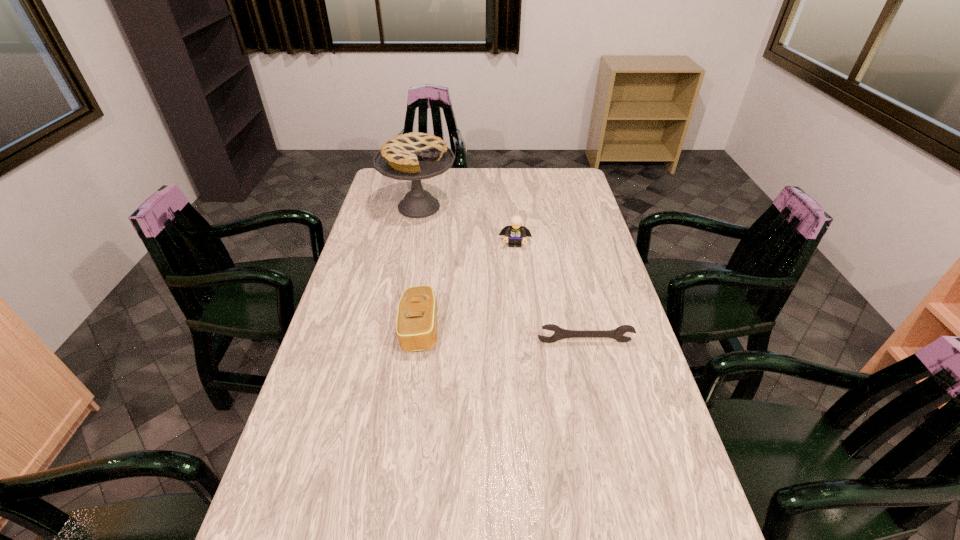
The image size is (960, 540). Identify the location of free space at the right edge of the desktop. (641, 480).

The height and width of the screenshot is (540, 960). In order to click on free area in between the wrench and the tallest object in this screenshot , I will do `click(502, 274)`.

You are a GUI agent. You are given a task and a screenshot of the screen. Output one action in this format:
    pyautogui.click(x=<x>, y=<y>)
    Task: Click on the vacant point located between the clutch bag and the farthest object
    This screenshot has height=540, width=960.
    Given the screenshot: What is the action you would take?
    pyautogui.click(x=420, y=268)

Where is `free space between the third tallest object and the second farthest object`? The image size is (960, 540). free space between the third tallest object and the second farthest object is located at coordinates (468, 286).

Where is `free spot between the clutch bag and the pie`? This screenshot has width=960, height=540. free spot between the clutch bag and the pie is located at coordinates (420, 268).

Locate an element on the screen. Image resolution: width=960 pixels, height=540 pixels. free spot between the tallest object and the shortest object is located at coordinates (502, 274).

Where is `blank region between the third tallest object and the tallest object`? blank region between the third tallest object and the tallest object is located at coordinates (420, 268).

Find the location of a particular element. The image size is (960, 540). free space between the tallest object and the wrench is located at coordinates (502, 274).

You are a GUI agent. You are given a task and a screenshot of the screen. Output one action in this format:
    pyautogui.click(x=<x>, y=<y>)
    Task: Click on the free spot between the third shortest object and the second shortest object
    
    Given the screenshot: What is the action you would take?
    point(468,286)

The width and height of the screenshot is (960, 540). What are the coordinates of `vacant area that lies between the tallest object and the clutch bag` in the screenshot? It's located at tap(420, 268).